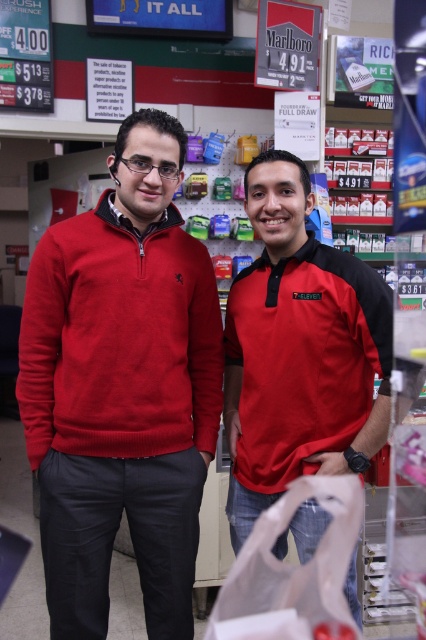
Can you confirm if matte red sweater at center is positioned to the left of matte red polo shirt at center?

Yes, matte red sweater at center is to the left of matte red polo shirt at center.

From the picture: Does matte red sweater at center come behind matte red polo shirt at center?

That is True.

Which is in front, point (204, 339) or point (233, 355)?

Point (204, 339) is more forward.

Where is `matte red sweater at center`? matte red sweater at center is located at coordinates (121, 387).

Does matte red sweater at center appear under transparent plastic bag at center?

No, matte red sweater at center is not below transparent plastic bag at center.

Who is more distant from viewer, (126, 291) or (245, 611)?

Positioned behind is point (245, 611).

Between point (118, 195) and point (262, 556), which one is positioned in front?

Point (118, 195) is more forward.

Where is `matte red sweater at center`? The height and width of the screenshot is (640, 426). matte red sweater at center is located at coordinates (121, 387).

This screenshot has height=640, width=426. Describe the element at coordinates (299, 349) in the screenshot. I see `matte red polo shirt at center` at that location.

Measure the distance from matte red polo shirt at center to transparent plastic bag at center.

matte red polo shirt at center is 12.99 inches from transparent plastic bag at center.

Which is behind, point (236, 394) or point (261, 554)?

The point (236, 394) is behind.

At what (x,y) coordinates should I click in order to perform the action: click on matte red polo shirt at center. Please return your answer as a coordinate pair (x, y). Looking at the image, I should click on (299, 349).